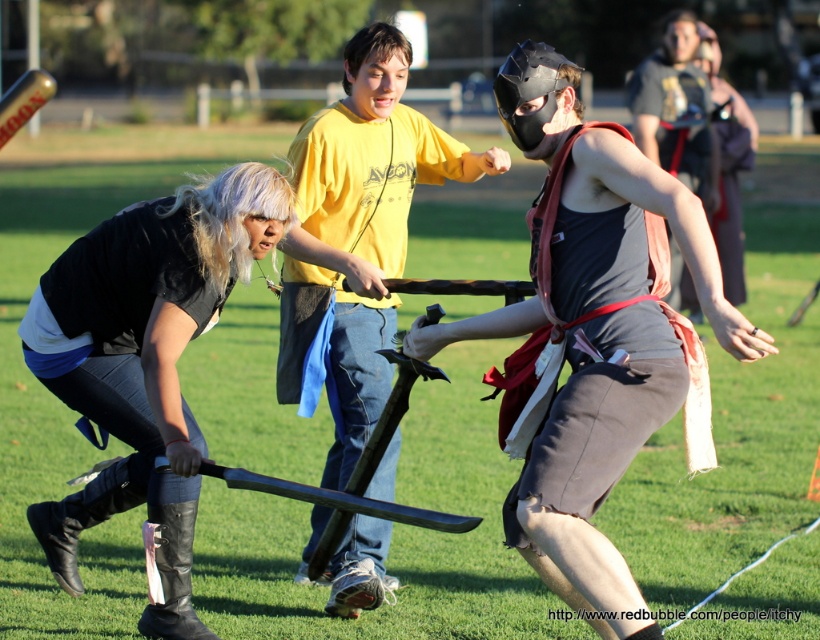
In the scene shown: You are a spectator standing at the edge of the field watching the mock sword fight. You want to throw a small pebble to the area between the black leather boots at lower left and the matte black helmet at center. If the pebble travels in a straight line, will it pass between them without hitting either object?

The black leather boots at lower left and matte black helmet at center are 11.96 feet apart from each other. Since the distance between them is over 11 feet, the pebble thrown in a straight line will pass between them without hitting either object.

You are a spectator standing at the edge of the field watching the mock sword fight. You notice two items in the scene. The first is the black leather boots at lower left and the second is the matte black helmet at center. Which of these two items has a smaller width?

The black leather boots at lower left is thinner than the matte black helmet at center, so the black leather boots at lower left has a smaller width.